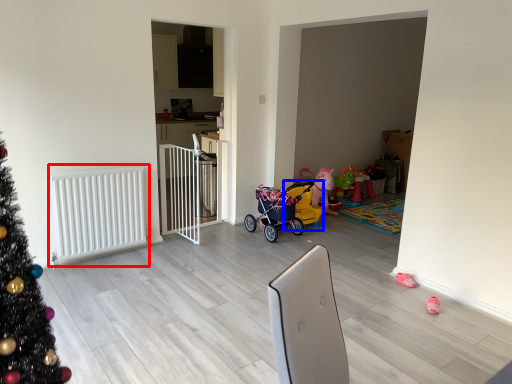
Question: Which object appears closest to the camera in this image, radiator (highlighted by a red box) or baby carriage (highlighted by a blue box)?

Choices:
 (A) radiator
 (B) baby carriage

Answer: (A)